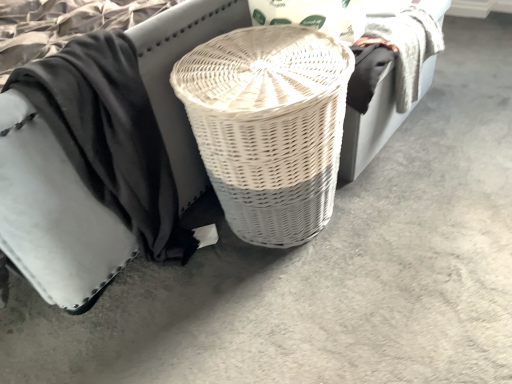
Question: In terms of width, does white wicker basket at center look wider or thinner when compared to white wicker basket at center?

Choices:
 (A) wide
 (B) thin

Answer: (B)

Question: From the image's perspective, is white wicker basket at center positioned above or below white wicker basket at center?

Choices:
 (A) above
 (B) below

Answer: (B)

Question: Which is nearer to the black cotton cloth at center?

Choices:
 (A) white wicker basket at center
 (B) white wicker basket at center

Answer: (A)

Question: Which is farther from the black cotton cloth at center?

Choices:
 (A) white wicker basket at center
 (B) white wicker basket at center

Answer: (A)